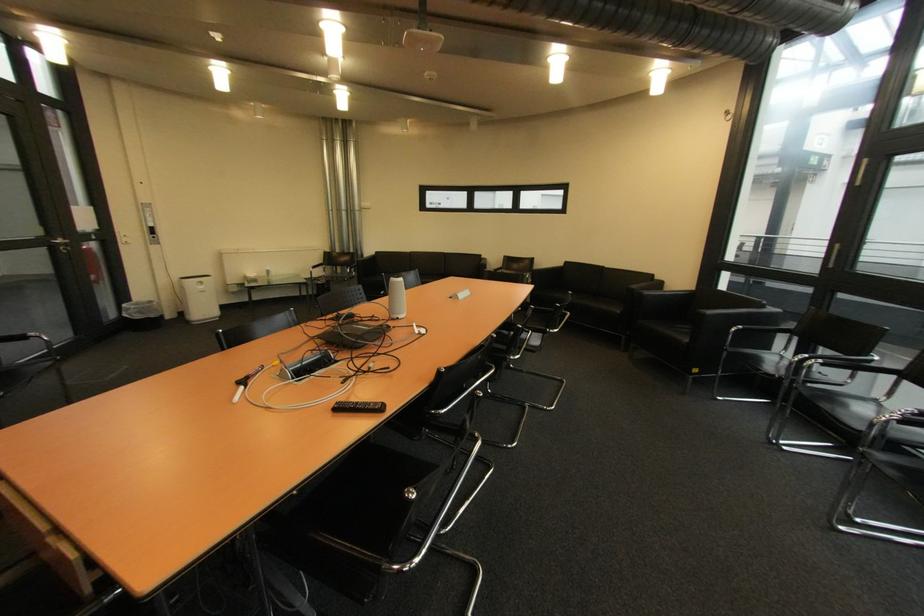
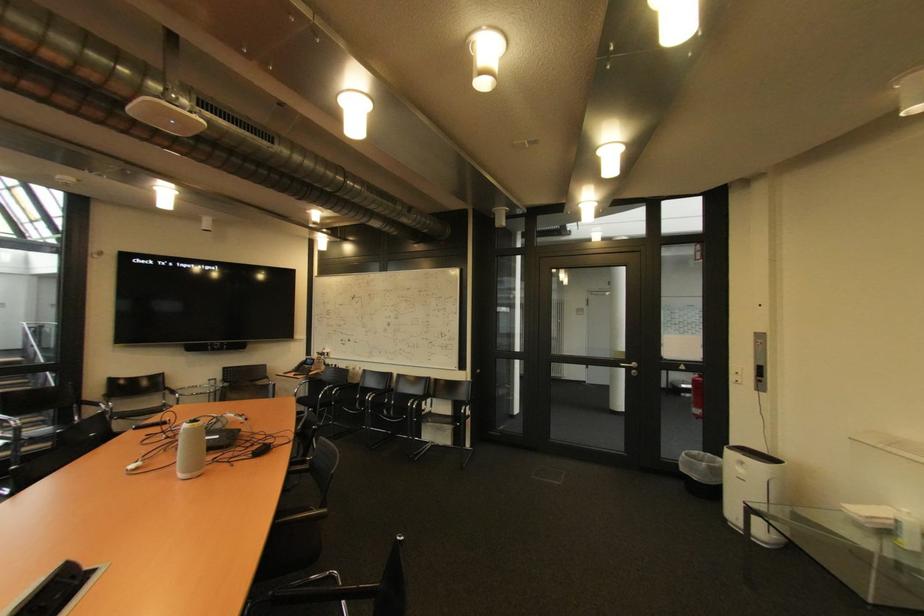
Question: I am providing you with two images of the same scene from different viewpoints. After the viewpoint changes to image2, which objects are now occluded?

Choices:
 (A) black chair armrest
 (B) red fire extinguisher
 (C) hammock sitting surface
 (D) chair sitting surface

Answer: (D)